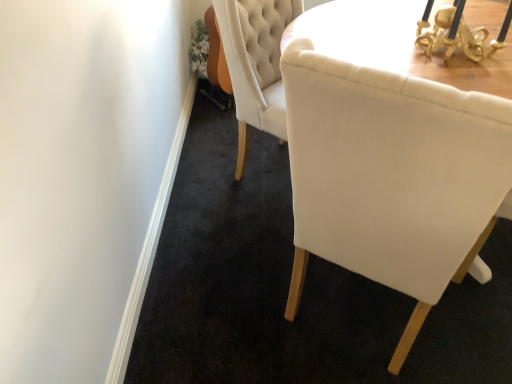
Question: Is point (479, 46) positioned closer to the camera than point (444, 114)?

Choices:
 (A) closer
 (B) farther

Answer: (B)

Question: Choose the correct answer: Is gold metallic table lamp at upper right inside matte white chair at center or outside it?

Choices:
 (A) inside
 (B) outside

Answer: (B)

Question: Based on their positions, is gold metallic table lamp at upper right located to the left or right of matte white chair at center?

Choices:
 (A) left
 (B) right

Answer: (B)

Question: From the image's perspective, relative to gold metallic table lamp at upper right, is matte white chair at center above or below?

Choices:
 (A) below
 (B) above

Answer: (A)

Question: Considering their positions, is matte white chair at center located in front of or behind gold metallic table lamp at upper right?

Choices:
 (A) front
 (B) behind

Answer: (A)

Question: From their relative heights in the image, would you say matte white chair at center is taller or shorter than gold metallic table lamp at upper right?

Choices:
 (A) tall
 (B) short

Answer: (A)

Question: In terms of width, does matte white chair at center look wider or thinner when compared to gold metallic table lamp at upper right?

Choices:
 (A) thin
 (B) wide

Answer: (B)